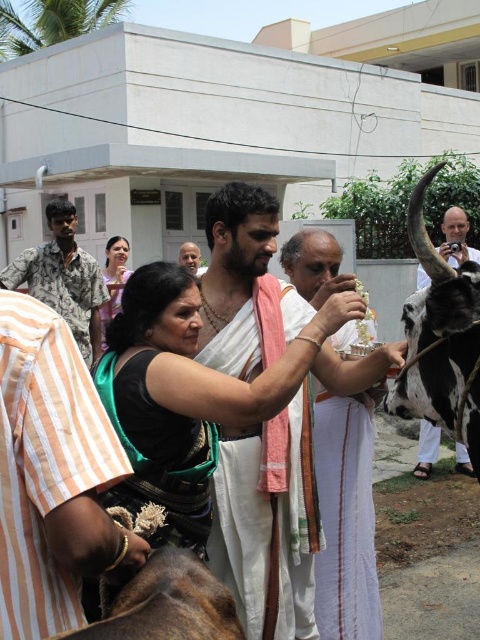
In the scene shown: You are an anthropologist observing a traditional Indian ceremony. You notice a white clothed man at center and a black and white cow at right. Which object has a greater width?

The white clothed man at center has a greater width than the black and white cow at right.

Looking at this image, you are a photographer at the event and want to capture both the white clothed man at center and the white silk dhoti at center in a single frame. Given that your camera can only focus on objects within a 1.5 meter distance, will you be able to include both in the shot?

The white clothed man at center is larger in size than the white silk dhoti at center, but the question of distance isn